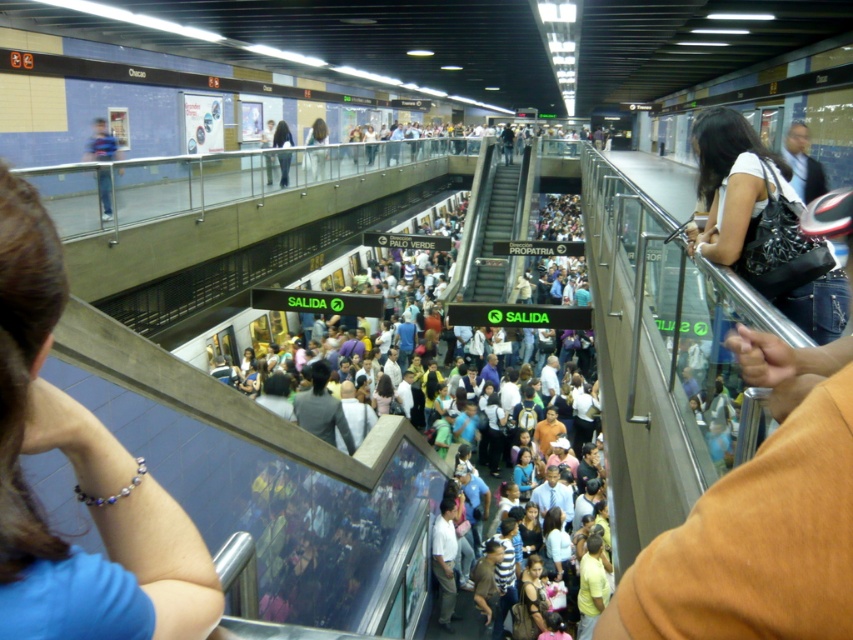
You are an inspector checking the subway station layout. You need to locate the blue fabric bracelet at upper left. According to the coordinates given, where exactly is it positioned in the image?

The blue fabric bracelet at upper left is positioned at the 2D coordinates point (x=78, y=477).

You are standing in the subway station and want to take a photo of the multicolored fabric crowd at center. Your camera has a minimum focusing distance of 40 inches. Will you be able to take the photo without moving closer?

The multicolored fabric crowd at center is 38.61 inches away from the viewer, which is closer than the camera minimum focusing distance of 40 inches. Therefore, you won cannot take the photo without moving further back.

You are a photographer trying to capture the entire scene of the subway station. You notice the multicolored fabric crowd at center and the matte black purse at upper right. Which object would require a wider angle lens to include in your photo?

The multicolored fabric crowd at center has a larger width than the matte black purse at upper right, so it would require a wider angle lens to capture the entire scene.